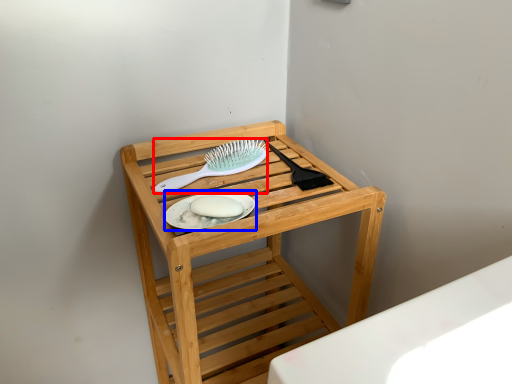
Question: Which object appears closest to the camera in this image, brush (highlighted by a red box) or platter (highlighted by a blue box)?

Choices:
 (A) brush
 (B) platter

Answer: (B)